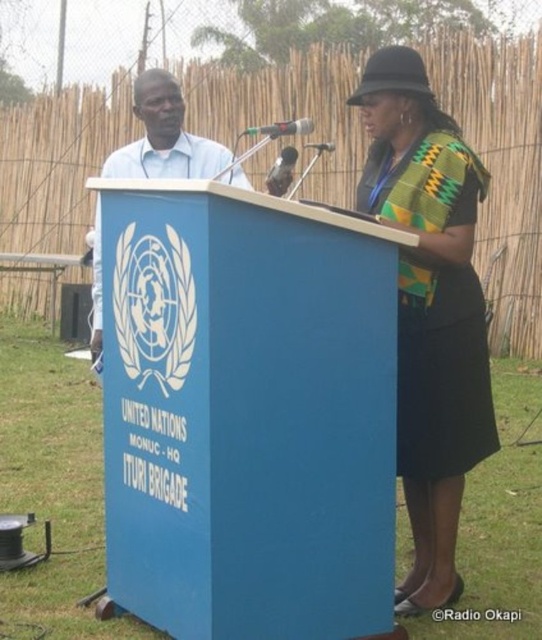
Which is more to the left, metallic/matte black microphone at center or metallic shiny microphone at center?

metallic/matte black microphone at center

This screenshot has width=542, height=640. In order to click on metallic/matte black microphone at center in this screenshot , I will do `click(282, 129)`.

The height and width of the screenshot is (640, 542). In order to click on metallic/matte black microphone at center in this screenshot , I will do `click(282, 129)`.

Who is more distant from viewer, (136, 342) or (332, 145)?

Point (332, 145)

Does blue painted wood podium at center have a lesser width compared to metallic shiny microphone at center?

Incorrect, blue painted wood podium at center's width is not less than metallic shiny microphone at center's.

Who is more distant from viewer, (214, 246) or (319, 147)?

Positioned behind is point (319, 147).

I want to click on blue painted wood podium at center, so click(247, 413).

Between matte blue podium at left and metallic shiny microphone at center, which one has less height?

metallic shiny microphone at center

Does matte blue podium at left lie in front of metallic shiny microphone at center?

Yes, it is.

Locate an element on the screen. The width and height of the screenshot is (542, 640). matte blue podium at left is located at coordinates (164, 138).